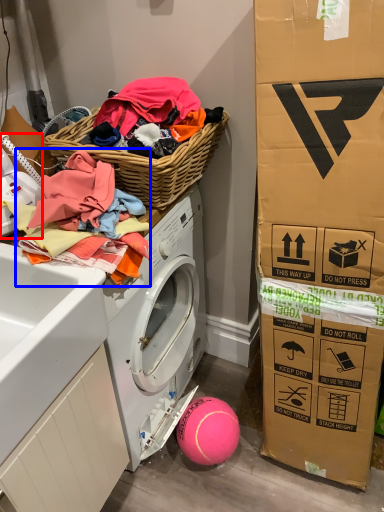
Question: Among these objects, which one is farthest to the camera, washer (highlighted by a red box) or clothing (highlighted by a blue box)?

Choices:
 (A) washer
 (B) clothing

Answer: (A)